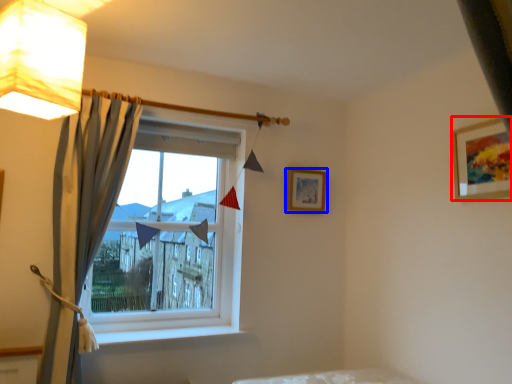
Question: Which of the following is the farthest to the observer, picture frame (highlighted by a red box) or picture frame (highlighted by a blue box)?

Choices:
 (A) picture frame
 (B) picture frame

Answer: (B)